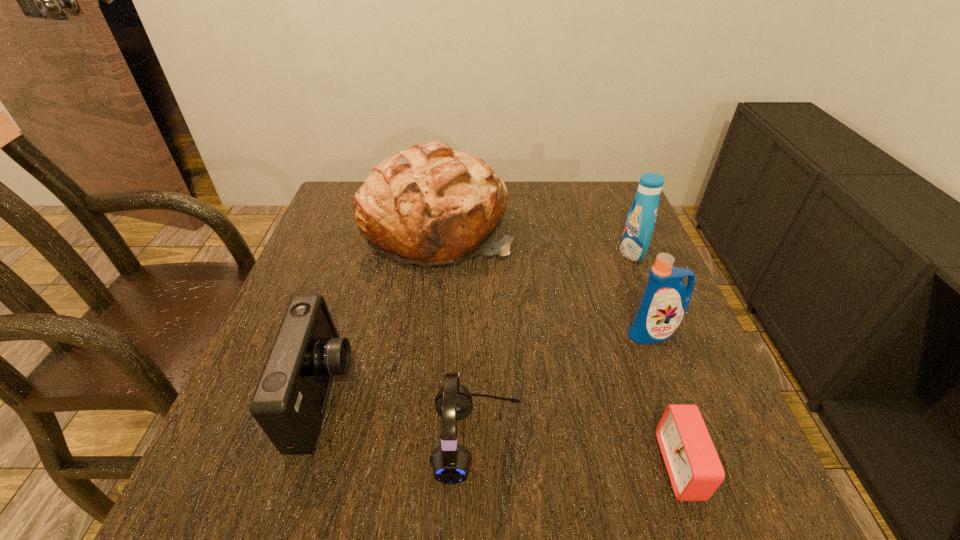
Find the location of a particular element. free space at the near right corner of the desktop is located at coordinates (667, 514).

Locate an element on the screen. This screenshot has height=540, width=960. vacant area that lies between the bread and the shortest object is located at coordinates (559, 346).

Where is `vacant space that is in between the bread and the farther detergent`? vacant space that is in between the bread and the farther detergent is located at coordinates (534, 239).

I want to click on free point between the nearer detergent and the camera, so click(x=489, y=365).

Find the location of a particular element. The image size is (960, 540). blank region between the camera and the fourth nearest object is located at coordinates (489, 365).

The height and width of the screenshot is (540, 960). Find the location of `vacant area that lies between the shortest object and the camera`. vacant area that lies between the shortest object and the camera is located at coordinates (502, 431).

I want to click on vacant area between the fourth nearest object and the headset, so point(565,387).

The width and height of the screenshot is (960, 540). Find the location of `vacant space in between the bread and the alarm clock`. vacant space in between the bread and the alarm clock is located at coordinates (559, 346).

Identify the location of vacant space that is in between the headset and the farther detergent. This screenshot has width=960, height=540. (555, 347).

I want to click on free area in between the farther detergent and the shortest object, so click(x=657, y=359).